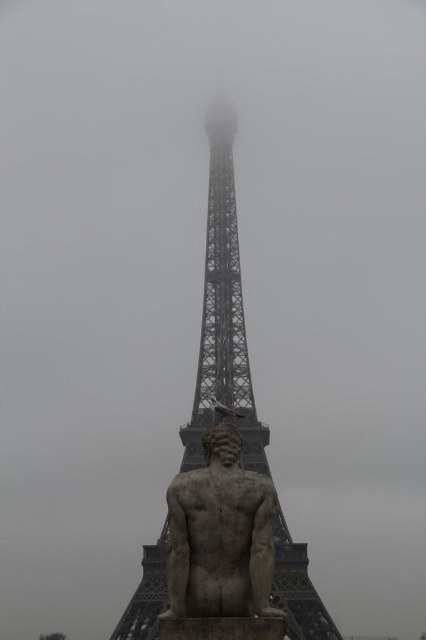
Question: Is metallic gray eiffel tower at center further to camera compared to stone statue at lower center?

Choices:
 (A) yes
 (B) no

Answer: (A)

Question: Which of the following is the farthest from the observer?

Choices:
 (A) (230, 531)
 (B) (219, 244)

Answer: (B)

Question: Which point is closer to the camera?

Choices:
 (A) click(x=238, y=340)
 (B) click(x=198, y=589)

Answer: (B)

Question: Does metallic gray eiffel tower at center appear on the right side of stone statue at lower center?

Choices:
 (A) yes
 (B) no

Answer: (B)

Question: Is metallic gray eiffel tower at center to the left of stone statue at lower center from the viewer's perspective?

Choices:
 (A) yes
 (B) no

Answer: (A)

Question: Which of the following is the farthest from the observer?

Choices:
 (A) metallic gray eiffel tower at center
 (B) stone statue at lower center

Answer: (A)